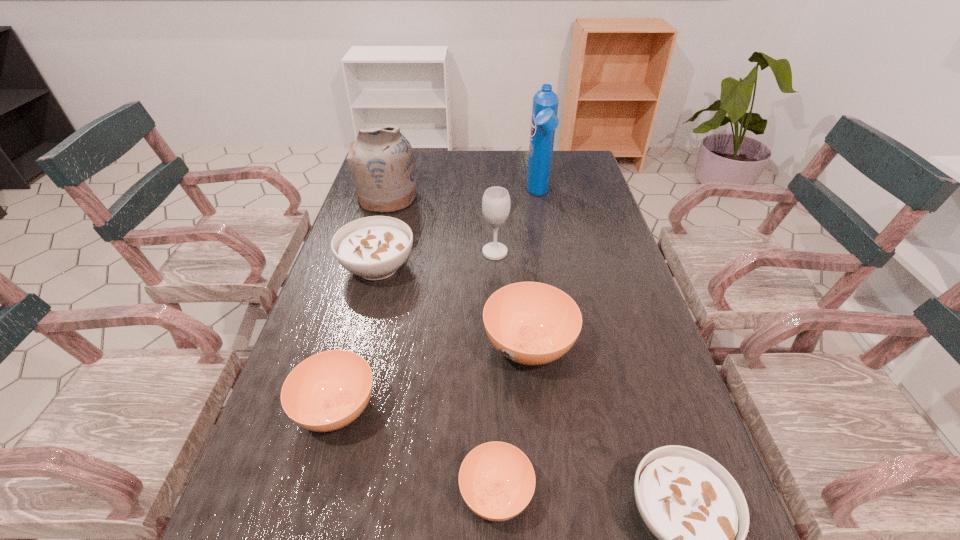
Find the location of a particular element. The image size is (960, 540). shampoo is located at coordinates (544, 121).

Locate an element on the screen. This screenshot has height=540, width=960. the second tallest object is located at coordinates (381, 160).

You are a GUI agent. You are given a task and a screenshot of the screen. Output one action in this format:
    pyautogui.click(x=<x>, y=<y>)
    Task: Click on the sixth shortest object
    This screenshot has height=540, width=960.
    Given the screenshot: What is the action you would take?
    [x=496, y=201]

This screenshot has height=540, width=960. In order to click on the biggest peach soup bowl in this screenshot , I will do `click(530, 323)`.

At what (x,y) coordinates should I click in order to perform the action: click on the farther white soup bowl. Please return your answer as a coordinate pair (x, y). Looking at the image, I should click on (374, 247).

Find the location of a particular element. the farthest soup bowl is located at coordinates (374, 247).

Identify the location of the leftmost peach soup bowl. (327, 391).

Locate an element on the screen. the nearest peach soup bowl is located at coordinates (497, 481).

You are a GUI agent. You are given a task and a screenshot of the screen. Output one action in this format:
    pyautogui.click(x=<x>, y=<y>)
    Task: Click on the shortest object
    
    Given the screenshot: What is the action you would take?
    pyautogui.click(x=497, y=481)

Locate an element on the screen. free region located 0.070m on the left of the tallest object is located at coordinates (506, 195).